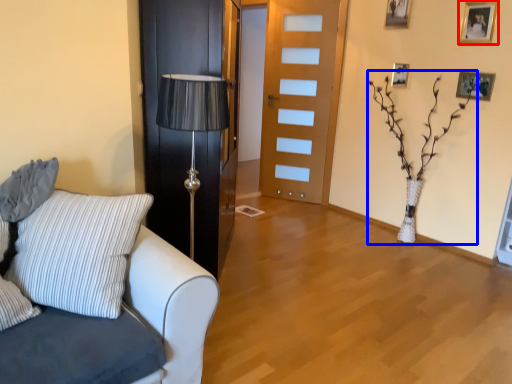
Question: Which object appears closest to the camera in this image, picture frame (highlighted by a red box) or plant (highlighted by a blue box)?

Choices:
 (A) picture frame
 (B) plant

Answer: (B)